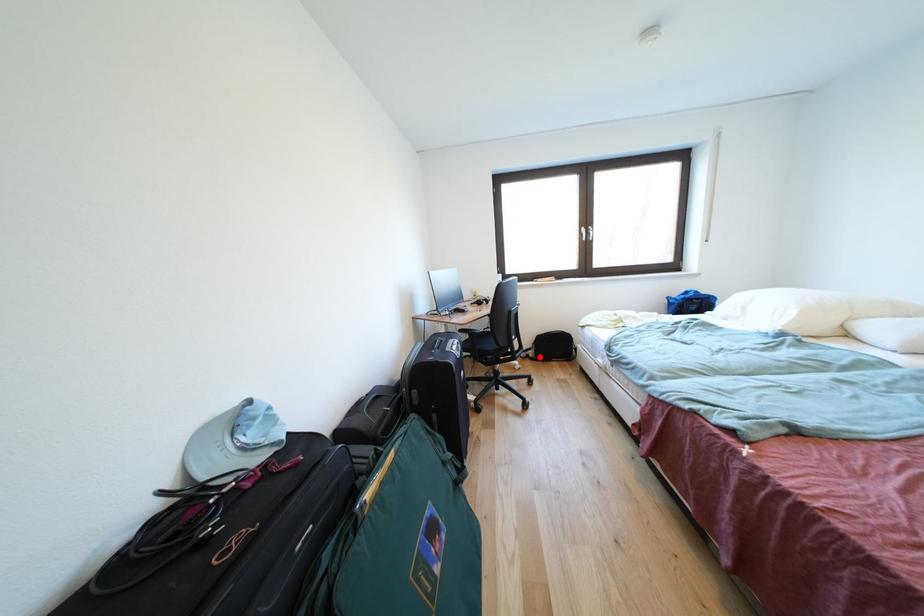
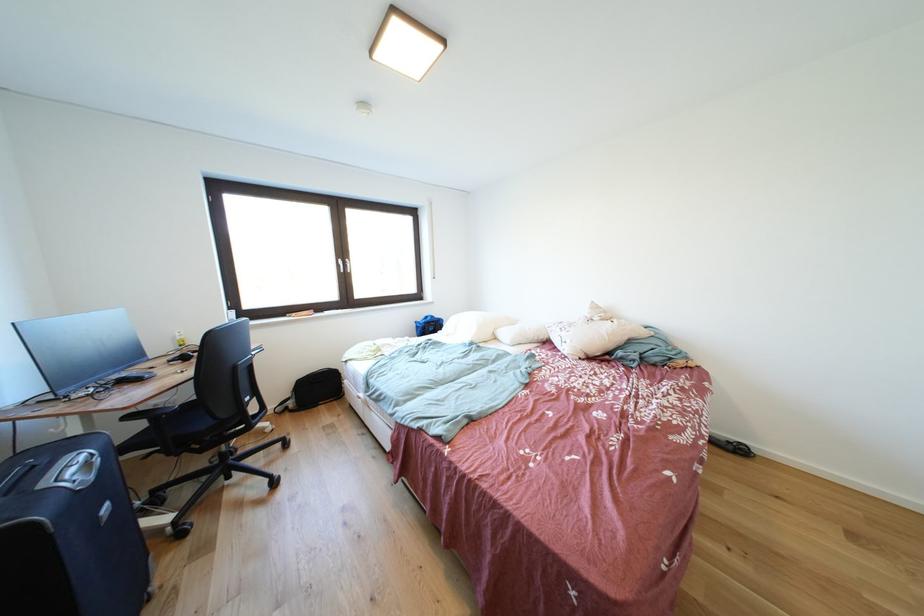
Locate, in the second image, the point that corresponds to the highlighted location in the first image.

(299, 408)